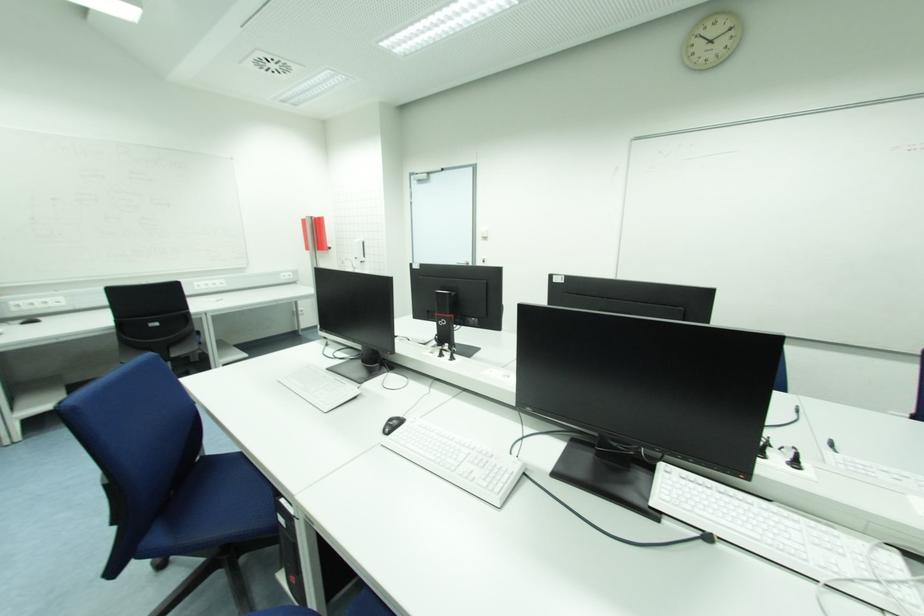
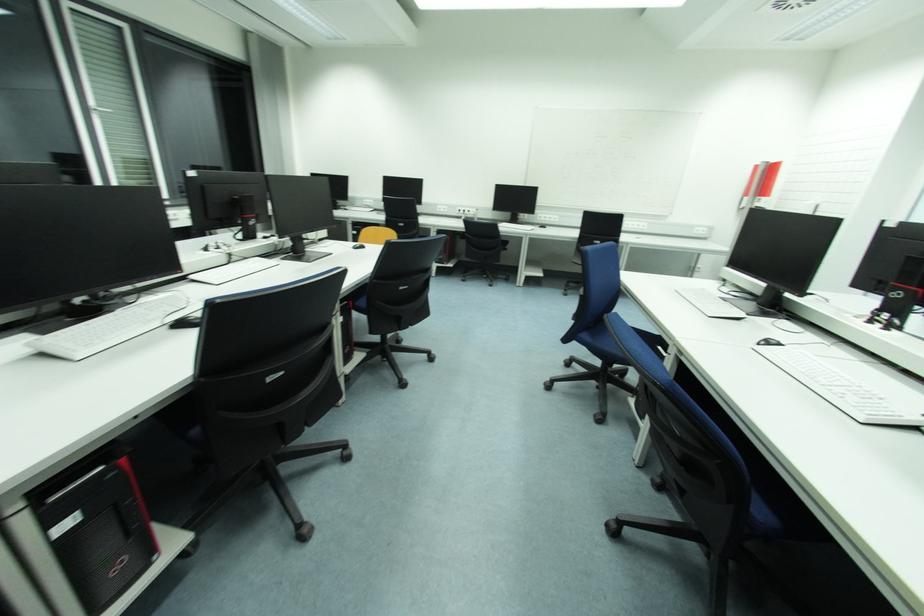
Question: The images are taken continuously from a first-person perspective. In which direction is your viewpoint rotating?

Choices:
 (A) Left
 (B) Right
 (C) Up
 (D) Down

Answer: (A)